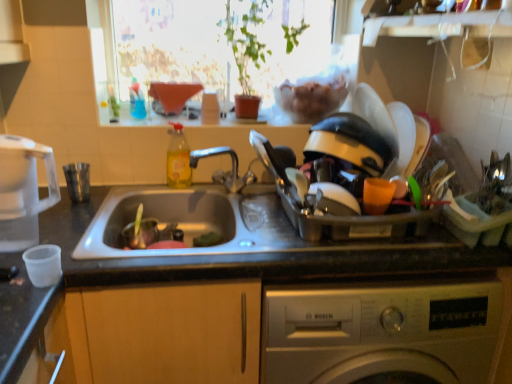
This screenshot has width=512, height=384. In order to click on vacant space positioned to the left of translucent yellow liquid at sink left in this screenshot , I will do `click(142, 188)`.